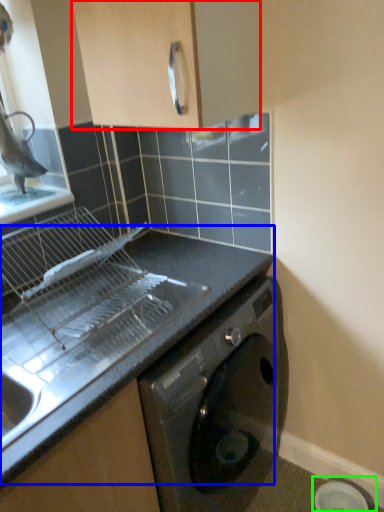
Question: Which is nearer to the cabinetry (highlighted by a red box)? countertop (highlighted by a blue box) or appliance (highlighted by a green box).

Choices:
 (A) countertop
 (B) appliance

Answer: (A)